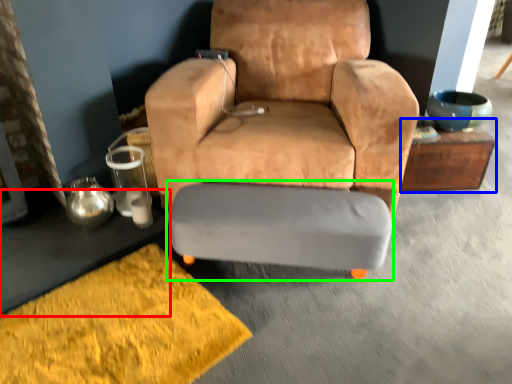
Question: Which object is positioned closest to table (highlighted by a red box)? Select from table (highlighted by a blue box) and swivel chair (highlighted by a green box).

Choices:
 (A) table
 (B) swivel chair

Answer: (B)